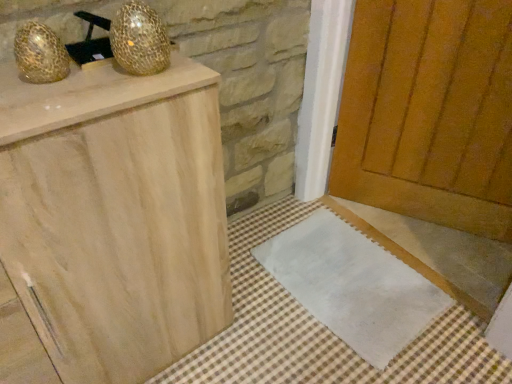
Question: Are white fabric doormat at lower center and gold mesh disco ball at upper left, the 2th disco ball when ordered from left to right, far apart?

Choices:
 (A) yes
 (B) no

Answer: (A)

Question: Is white fabric doormat at lower center positioned with its back to gold mesh disco ball at upper left, the first disco ball when ordered from right to left?

Choices:
 (A) yes
 (B) no

Answer: (B)

Question: Is gold mesh disco ball at upper left, the first disco ball when ordered from right to left, inside white fabric doormat at lower center?

Choices:
 (A) no
 (B) yes

Answer: (A)

Question: Considering the relative sizes of white fabric doormat at lower center and gold mesh disco ball at upper left, the 2th disco ball when ordered from left to right, in the image provided, is white fabric doormat at lower center bigger than gold mesh disco ball at upper left, the 2th disco ball when ordered from left to right,?

Choices:
 (A) no
 (B) yes

Answer: (B)

Question: From the image's perspective, would you say white fabric doormat at lower center is positioned over gold mesh disco ball at upper left, the 2th disco ball when ordered from left to right?

Choices:
 (A) yes
 (B) no

Answer: (B)

Question: Is gold textured egg at upper left, the 1th disco ball in the left-to-right sequence, bigger or smaller than wooden door at center?

Choices:
 (A) small
 (B) big

Answer: (A)

Question: Is gold textured egg at upper left, the 1th disco ball in the left-to-right sequence, in front of or behind wooden door at center in the image?

Choices:
 (A) front
 (B) behind

Answer: (A)

Question: Would you say gold textured egg at upper left, the 1th disco ball in the left-to-right sequence, is to the left or to the right of wooden door at center in the picture?

Choices:
 (A) right
 (B) left

Answer: (B)

Question: Considering the positions of point (52, 31) and point (450, 39), is point (52, 31) closer or farther from the camera than point (450, 39)?

Choices:
 (A) farther
 (B) closer

Answer: (B)

Question: From the image's perspective, is wooden door at center above or below gold textured egg at upper left, the second disco ball viewed from the right?

Choices:
 (A) below
 (B) above

Answer: (A)

Question: Is wooden door at center in front of or behind gold textured egg at upper left, the 1th disco ball in the left-to-right sequence, in the image?

Choices:
 (A) front
 (B) behind

Answer: (B)

Question: Considering the positions of wooden door at center and gold textured egg at upper left, the 1th disco ball in the left-to-right sequence, in the image, is wooden door at center wider or thinner than gold textured egg at upper left, the 1th disco ball in the left-to-right sequence,?

Choices:
 (A) wide
 (B) thin

Answer: (A)

Question: Is point (411, 173) positioned closer to the camera than point (53, 36)?

Choices:
 (A) closer
 (B) farther

Answer: (B)

Question: Considering the positions of gold mesh disco ball at upper left, the 2th disco ball when ordered from left to right, and wooden door at center in the image, is gold mesh disco ball at upper left, the 2th disco ball when ordered from left to right, taller or shorter than wooden door at center?

Choices:
 (A) tall
 (B) short

Answer: (B)

Question: Considering the positions of gold mesh disco ball at upper left, the first disco ball when ordered from right to left, and wooden door at center in the image, is gold mesh disco ball at upper left, the first disco ball when ordered from right to left, bigger or smaller than wooden door at center?

Choices:
 (A) big
 (B) small

Answer: (B)